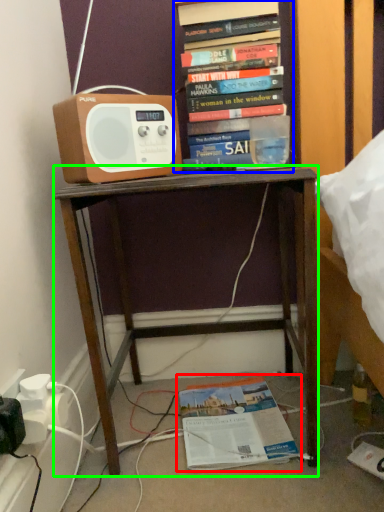
Question: Which object is the closest to the book (highlighted by a red box)? Choose among these: book (highlighted by a blue box) or desk (highlighted by a green box).

Choices:
 (A) book
 (B) desk

Answer: (B)